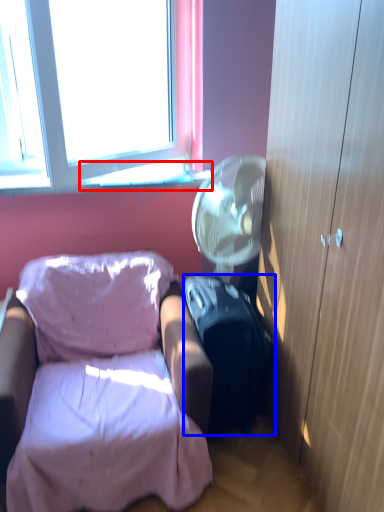
Question: Among these objects, which one is farthest to the camera, window sill (highlighted by a red box) or suitcase (highlighted by a blue box)?

Choices:
 (A) window sill
 (B) suitcase

Answer: (A)